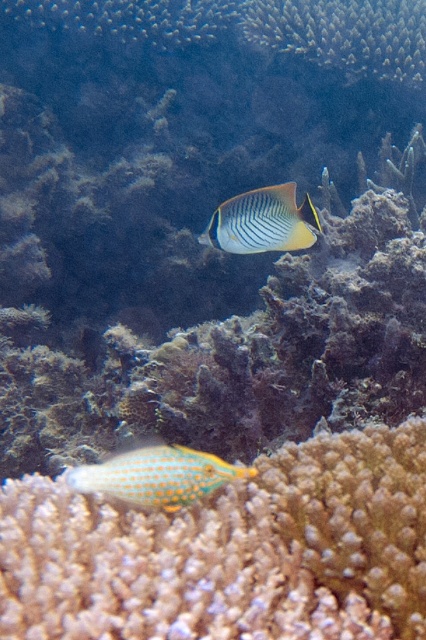
You are a marine biologist observing underwater. You notice an orange spotted coral at lower center and an orange speckled fish at lower left. Which object is located below the other?

The orange spotted coral at lower center is positioned under the orange speckled fish at lower left, so the coral is below the fish.

You are a marine biologist studying underwater landmarks. You notice the orange spotted coral at lower center. Can you determine its exact coordinates in the image?

The orange spotted coral at lower center is located at coordinates point (230,552).

You are an underwater photographer aiming to capture both the orange spotted coral at lower center and the orange speckled fish at lower left in a single frame. Based on their positions, which object is positioned to the right of the other?

The orange spotted coral at lower center is positioned to the right of the orange speckled fish at lower left.